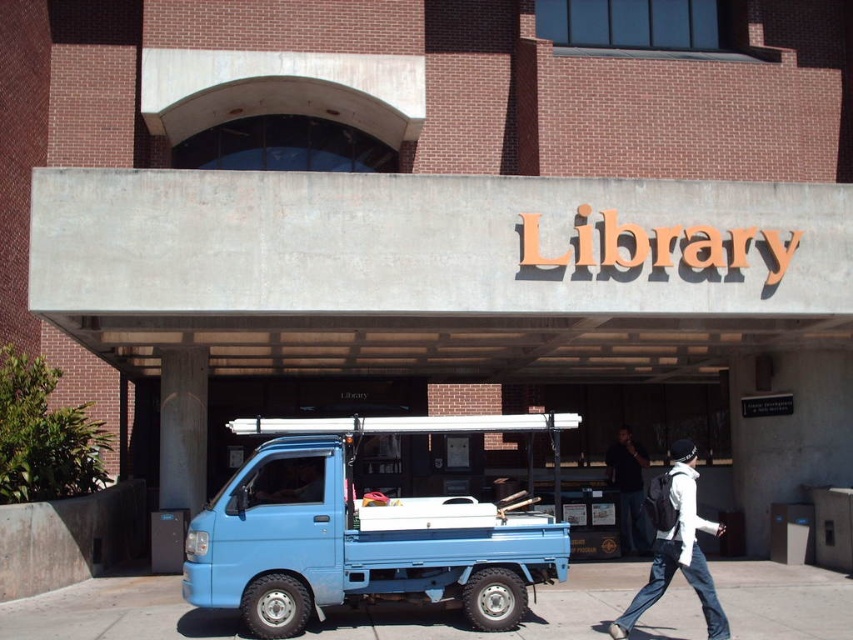
You are standing in front of the library and see the blue concrete pavement at lower center and the dark blue jeans at lower right. Which object covers a larger area?

The blue concrete pavement at lower center is bigger than the dark blue jeans at lower right, so it covers a larger area.

You are a delivery person who needs to park your vehicle in the parking lot near the library. You see the blue matte truck at lower left and the blue concrete pavement at lower center. Which one is more suitable for parking your vehicle?

The blue concrete pavement at lower center is more suitable for parking your vehicle because the blue matte truck at lower left has a smaller size compared to blue concrete pavement at lower center, indicating that the pavement has enough space to accommodate a larger vehicle.